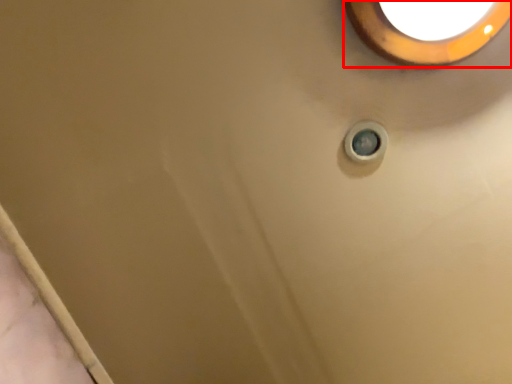
Question: From the image, what is the correct spatial relationship of lighting (annotated by the red box) in relation to knob?

Choices:
 (A) right
 (B) left

Answer: (A)